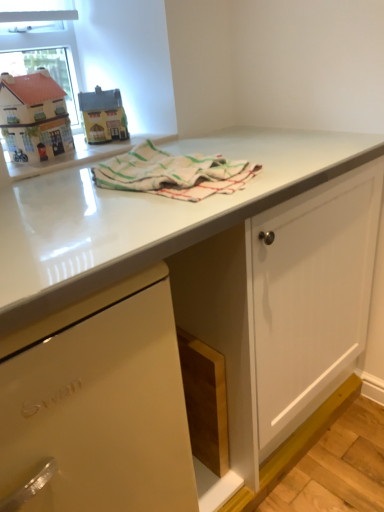
Find the location of a particular element. Image resolution: width=384 pixels, height=512 pixels. vacant area in front of matte plastic toy house at upper left is located at coordinates (92, 150).